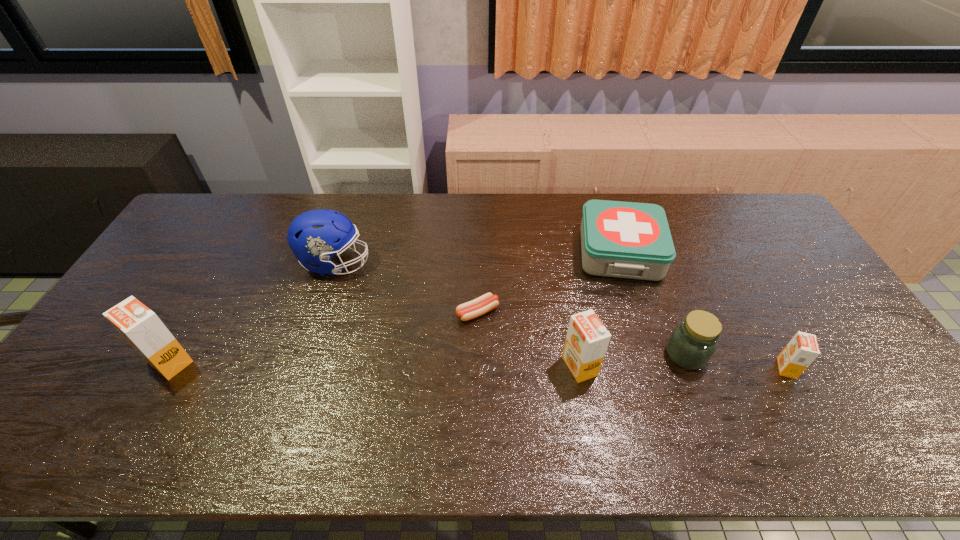
What are the coordinates of `vacant space that satisfies the following two spatial constraints: 1. on the front side of the third farthest object; 2. on the right side of the rightmost orange juice` in the screenshot? It's located at (477, 368).

The width and height of the screenshot is (960, 540). What are the coordinates of `free space that satisfies the following two spatial constraints: 1. on the back side of the second orange juice from right to left; 2. on the face guard of the sixth object from right to left` in the screenshot? It's located at (561, 263).